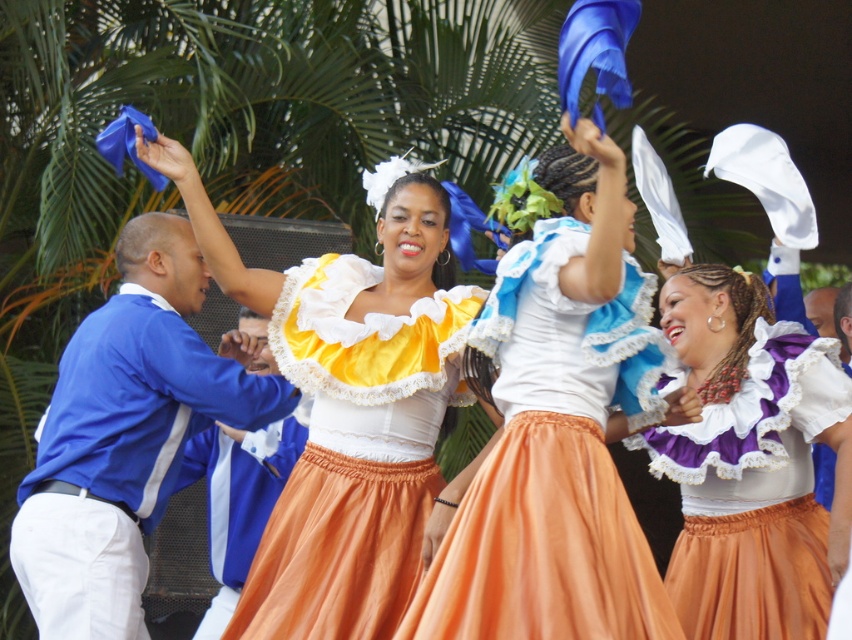
Question: Can you confirm if yellow satin blouse at center is positioned to the left of purple satin blouse at center?

Choices:
 (A) no
 (B) yes

Answer: (B)

Question: Can you confirm if yellow satin blouse at center is bigger than purple satin blouse at center?

Choices:
 (A) yes
 (B) no

Answer: (A)

Question: Which of the following is the farthest from the observer?

Choices:
 (A) yellow satin blouse at center
 (B) purple satin blouse at center
 (C) matte orange skirt at center
 (D) blue satin jacket at left

Answer: (A)

Question: Does matte orange skirt at center appear over purple satin blouse at center?

Choices:
 (A) yes
 (B) no

Answer: (A)

Question: Which point is closer to the camera taking this photo?

Choices:
 (A) (294, 486)
 (B) (22, 508)
 (C) (585, 148)
 (D) (810, 403)

Answer: (C)

Question: Among these points, which one is farthest from the camera?

Choices:
 (A) (665, 435)
 (B) (101, 518)
 (C) (213, 268)
 (D) (508, 376)

Answer: (C)